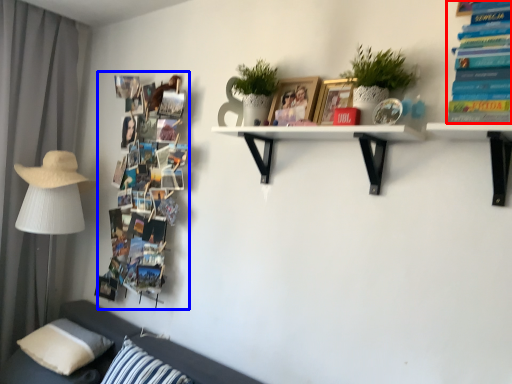
Question: Which object is closer to the camera taking this photo, book (highlighted by a red box) or book (highlighted by a blue box)?

Choices:
 (A) book
 (B) book

Answer: (A)